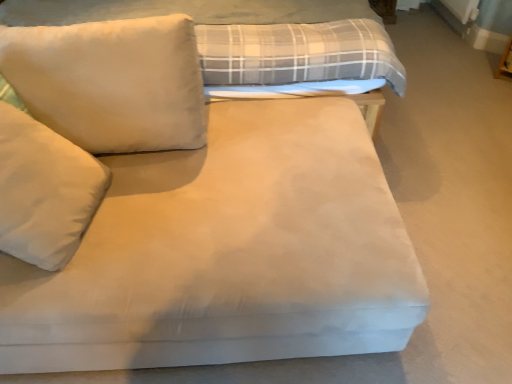
Question: From the image's perspective, is white soft pillow at left, the first pillow ordered from the bottom, under suede-like beige bed at center?

Choices:
 (A) yes
 (B) no

Answer: (A)

Question: Considering the relative positions of white soft pillow at left, the 2th pillow when ordered from top to bottom, and suede-like beige bed at center in the image provided, is white soft pillow at left, the 2th pillow when ordered from top to bottom, in front of suede-like beige bed at center?

Choices:
 (A) no
 (B) yes

Answer: (B)

Question: Is white soft pillow at left, the 2th pillow when ordered from top to bottom, touching suede-like beige bed at center?

Choices:
 (A) yes
 (B) no

Answer: (B)

Question: Is white soft pillow at left, the 2th pillow when ordered from top to bottom, outside of suede-like beige bed at center?

Choices:
 (A) yes
 (B) no

Answer: (A)

Question: Is there a large distance between white soft pillow at left, the 2th pillow when ordered from top to bottom, and suede-like beige bed at center?

Choices:
 (A) no
 (B) yes

Answer: (A)

Question: Relative to suede-like beige bed at center, is white soft pillow at left, the 2th pillow when ordered from top to bottom, in front or behind?

Choices:
 (A) behind
 (B) front

Answer: (B)

Question: Considering the positions of point (69, 251) and point (309, 44), is point (69, 251) closer or farther from the camera than point (309, 44)?

Choices:
 (A) closer
 (B) farther

Answer: (A)

Question: From the image's perspective, is white soft pillow at left, the 2th pillow when ordered from top to bottom, located above or below suede-like beige bed at center?

Choices:
 (A) above
 (B) below

Answer: (B)

Question: From a real-world perspective, relative to suede-like beige bed at center, is white soft pillow at left, the first pillow ordered from the bottom, vertically above or below?

Choices:
 (A) above
 (B) below

Answer: (A)

Question: Considering their positions, is suede-like beige bed at center located in front of or behind white soft pillow at left, the 2th pillow when ordered from top to bottom?

Choices:
 (A) front
 (B) behind

Answer: (B)

Question: Considering the positions of suede-like beige bed at center and white soft pillow at left, the first pillow ordered from the bottom, in the image, is suede-like beige bed at center wider or thinner than white soft pillow at left, the first pillow ordered from the bottom,?

Choices:
 (A) thin
 (B) wide

Answer: (B)

Question: Considering the relative positions of suede-like beige bed at center and white soft pillow at left, the first pillow ordered from the bottom, in the image provided, is suede-like beige bed at center to the left or to the right of white soft pillow at left, the first pillow ordered from the bottom,?

Choices:
 (A) right
 (B) left

Answer: (A)

Question: Considering the positions of suede-like beige bed at center and white soft pillow at left, the first pillow ordered from the bottom, in the image, is suede-like beige bed at center taller or shorter than white soft pillow at left, the first pillow ordered from the bottom,?

Choices:
 (A) tall
 (B) short

Answer: (A)

Question: Considering the positions of point (58, 165) and point (53, 72), is point (58, 165) closer or farther from the camera than point (53, 72)?

Choices:
 (A) closer
 (B) farther

Answer: (A)

Question: Considering the positions of white soft pillow at left, the 2th pillow when ordered from top to bottom, and white soft pillow at upper left, placed as the 2th pillow when sorted from bottom to top, in the image, is white soft pillow at left, the 2th pillow when ordered from top to bottom, wider or thinner than white soft pillow at upper left, placed as the 2th pillow when sorted from bottom to top,?

Choices:
 (A) wide
 (B) thin

Answer: (A)